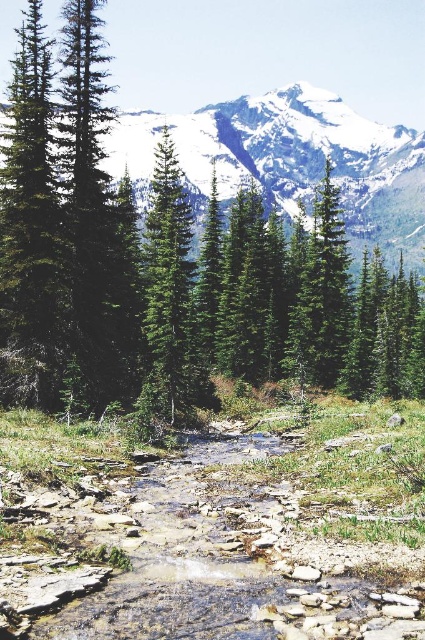
Question: Where is rocky gravel stream at center located in relation to snowy granite mountain at upper center in the image?

Choices:
 (A) left
 (B) right

Answer: (A)

Question: Estimate the real-world distances between objects in this image. Which object is closer to the snowy granite mountain at upper center?

Choices:
 (A) green matte tree at center
 (B) rocky gravel stream at center

Answer: (A)

Question: Which point is farther to the camera?

Choices:
 (A) (393, 193)
 (B) (110, 60)

Answer: (B)

Question: Is rocky gravel stream at center smaller than snowy granite mountain at upper center?

Choices:
 (A) no
 (B) yes

Answer: (B)

Question: Does green matte tree at center lie in front of rocky gravel stream at center?

Choices:
 (A) no
 (B) yes

Answer: (A)

Question: Which of the following is the farthest from the observer?

Choices:
 (A) (48, 320)
 (B) (246, 97)

Answer: (B)